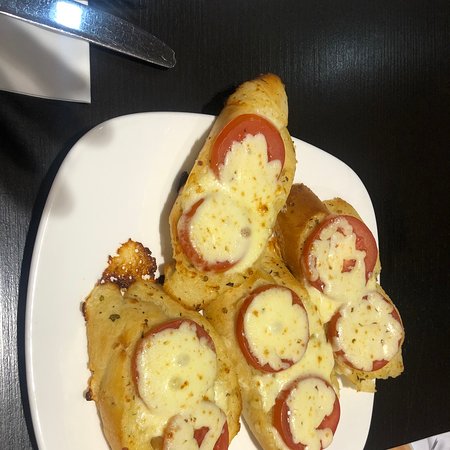
At what (x,y) coordinates should I click in order to perform the action: click on napkin. Please return your answer as a coordinate pair (x, y). Looking at the image, I should click on (35, 52).